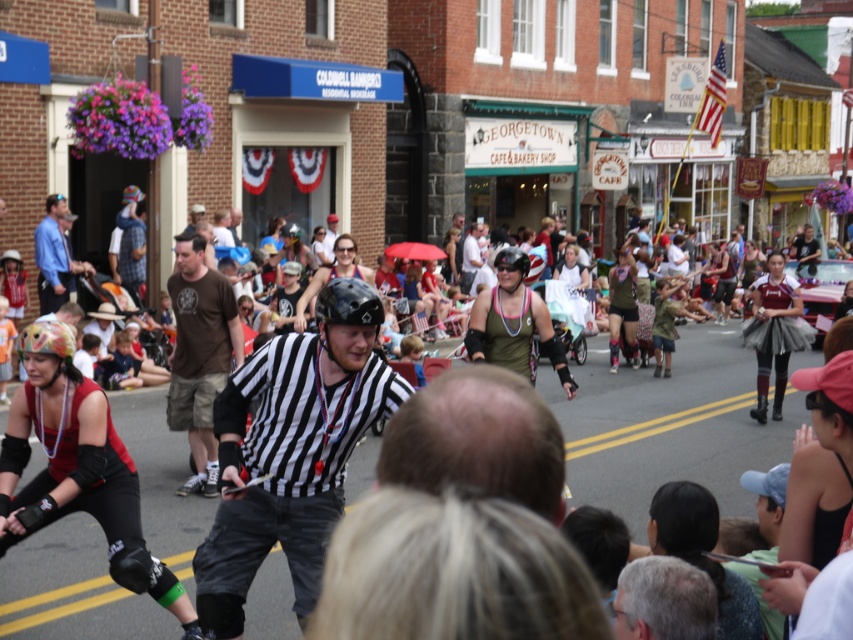
Question: Is black striped shirt at center wider than blue shirt at left?

Choices:
 (A) no
 (B) yes

Answer: (B)

Question: Can you confirm if black striped shirt at center is positioned below brown cotton t-shirt at center?

Choices:
 (A) yes
 (B) no

Answer: (A)

Question: Which object appears farthest from the camera in this image?

Choices:
 (A) brown cotton t-shirt at center
 (B) black striped shirt at center
 (C) reddish-brown leather helmet at center-left

Answer: (A)

Question: From the image, what is the correct spatial relationship of black striped shirt at center in relation to blue shirt at left?

Choices:
 (A) above
 (B) below

Answer: (B)

Question: Based on their relative distances, which object is nearer to the reddish-brown leather helmet at center-left?

Choices:
 (A) brown cotton t-shirt at center
 (B) black striped shirt at center

Answer: (B)

Question: Which point appears farthest from the camera in this image?

Choices:
 (A) (44, 506)
 (B) (234, 620)

Answer: (A)